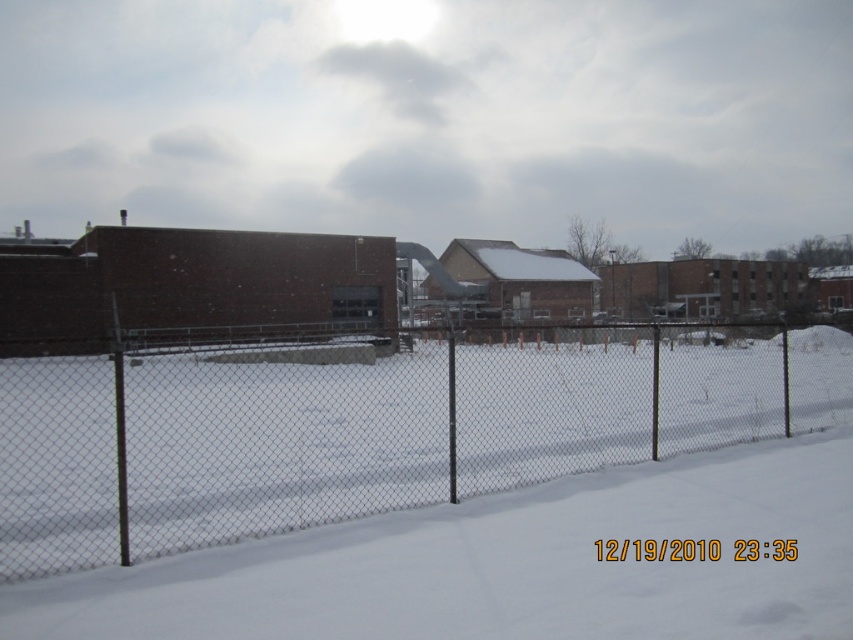
Question: Which point is farther to the camera?

Choices:
 (A) (360, 432)
 (B) (316, 595)

Answer: (A)

Question: Among these objects, which one is farthest from the camera?

Choices:
 (A) white powdery snow at center
 (B) wire mesh fence at center

Answer: (B)

Question: Does wire mesh fence at center appear under white powdery snow at center?

Choices:
 (A) yes
 (B) no

Answer: (B)

Question: Which point is closer to the camera?

Choices:
 (A) white powdery snow at center
 (B) wire mesh fence at center

Answer: (A)

Question: Can you confirm if wire mesh fence at center is positioned below white powdery snow at center?

Choices:
 (A) yes
 (B) no

Answer: (B)

Question: Can you confirm if wire mesh fence at center is wider than white powdery snow at center?

Choices:
 (A) yes
 (B) no

Answer: (A)